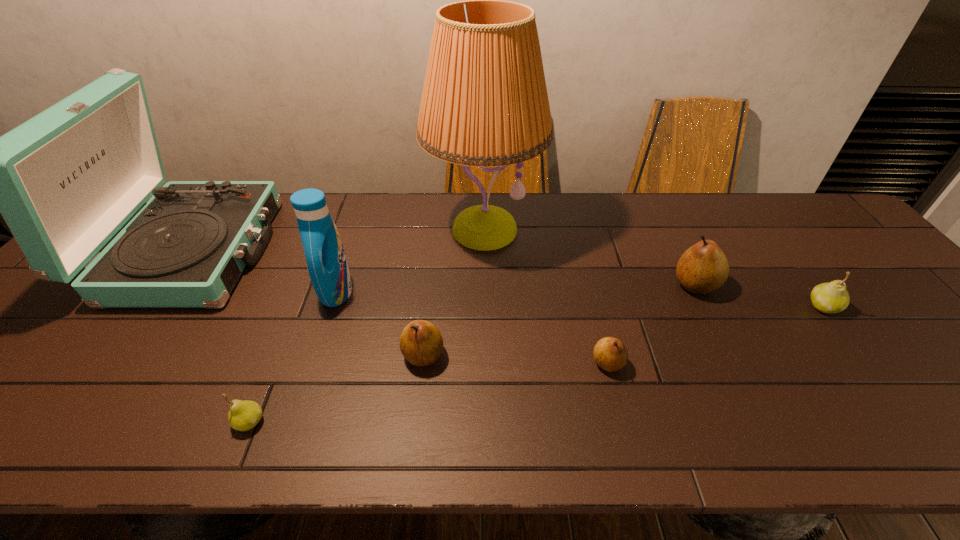
Where is `vacant space located 0.080m on the back of the rightmost pear`? vacant space located 0.080m on the back of the rightmost pear is located at coordinates (799, 274).

Where is `vacant area situated on the front of the fourth pear from right to left`? This screenshot has height=540, width=960. vacant area situated on the front of the fourth pear from right to left is located at coordinates (413, 449).

Identify the location of vacant space located on the right of the second brown pear from left to right. (740, 363).

You are a GUI agent. You are given a task and a screenshot of the screen. Output one action in this format:
    pyautogui.click(x=<x>, y=<y>)
    Task: Click on the vacant position located on the right of the seventh object from right to left
    This screenshot has height=540, width=960.
    Given the screenshot: What is the action you would take?
    pyautogui.click(x=315, y=422)

Identify the location of lamp that is at the far edge. Image resolution: width=960 pixels, height=540 pixels. (484, 103).

Where is `record player located in the far edge section of the desktop`? The width and height of the screenshot is (960, 540). record player located in the far edge section of the desktop is located at coordinates (65, 181).

Locate an element on the screen. object positioned at the near edge is located at coordinates (244, 415).

Find the location of a particular element. The width and height of the screenshot is (960, 540). object that is at the left edge is located at coordinates pyautogui.click(x=65, y=181).

Locate an element on the screen. object that is at the far left corner is located at coordinates (65, 181).

The width and height of the screenshot is (960, 540). In the image, there is a desktop. In order to click on vacant space at the far edge in this screenshot , I will do `click(686, 239)`.